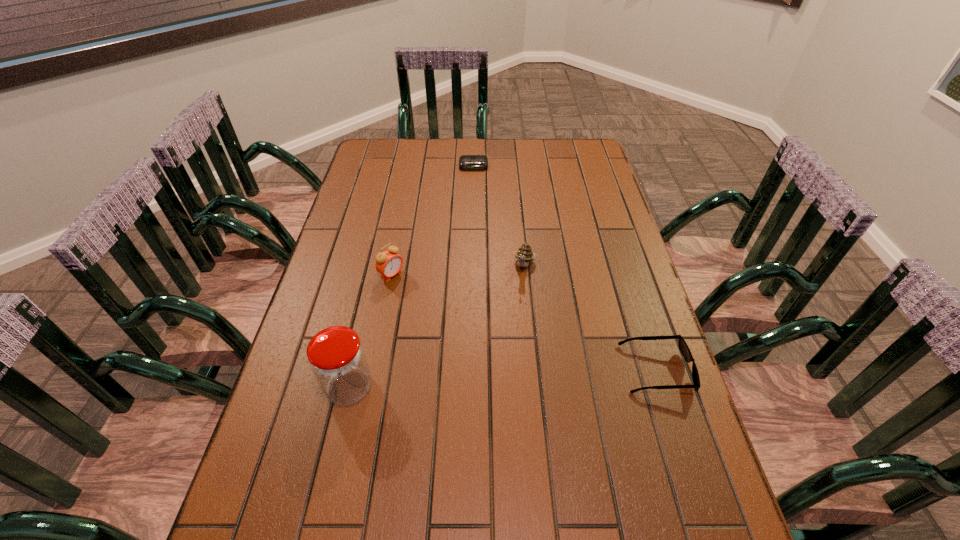
You are a GUI agent. You are given a task and a screenshot of the screen. Output one action in this format:
    pyautogui.click(x=<x>, y=<y>)
    Task: Click on the free point that satisfies the following two spatial constraints: 1. on the front side of the taller alarm clock; 2. on the front-facing side of the second shortest object
    The width and height of the screenshot is (960, 540).
    Given the screenshot: What is the action you would take?
    pyautogui.click(x=373, y=370)

Identify the location of free spot that satisfies the following two spatial constraints: 1. on the front side of the sunglasses; 2. on the front-facing side of the taller alarm clock. (373, 370).

I want to click on vacant space that satisfies the following two spatial constraints: 1. on the front side of the fourth object from left to right; 2. on the left side of the third object from right to left, so click(471, 266).

What are the coordinates of `free space that satisfies the following two spatial constraints: 1. on the back side of the taller alarm clock; 2. on the left side of the third object from right to left` in the screenshot? It's located at (413, 166).

The image size is (960, 540). What are the coordinates of `free space that satisfies the following two spatial constraints: 1. on the back side of the nearer alarm clock; 2. on the right side of the shorter alarm clock` in the screenshot? It's located at (413, 166).